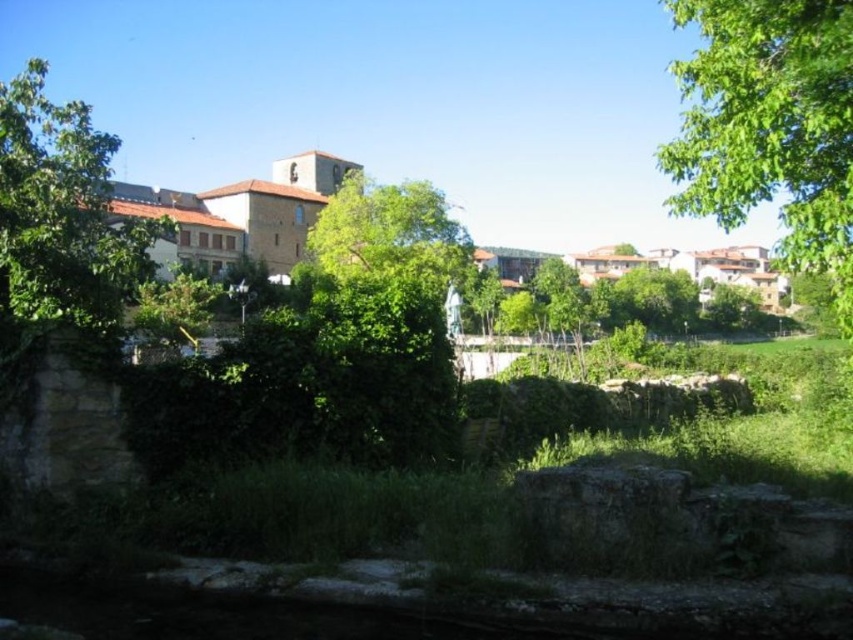
Question: Considering the relative positions of green leafy tree at upper right and green leafy tree at upper left in the image provided, where is green leafy tree at upper right located with respect to green leafy tree at upper left?

Choices:
 (A) below
 (B) above

Answer: (B)

Question: Among these points, which one is nearest to the camera?

Choices:
 (A) (3, 129)
 (B) (740, 80)

Answer: (B)

Question: Among these objects, which one is nearest to the camera?

Choices:
 (A) green leafy tree at upper right
 (B) green leafy tree at upper left

Answer: (A)

Question: Observing the image, what is the correct spatial positioning of green leafy tree at upper right in reference to green leafy tree at upper left?

Choices:
 (A) left
 (B) right

Answer: (B)

Question: Does green leafy tree at upper right appear on the left side of green leafy tree at upper left?

Choices:
 (A) no
 (B) yes

Answer: (A)